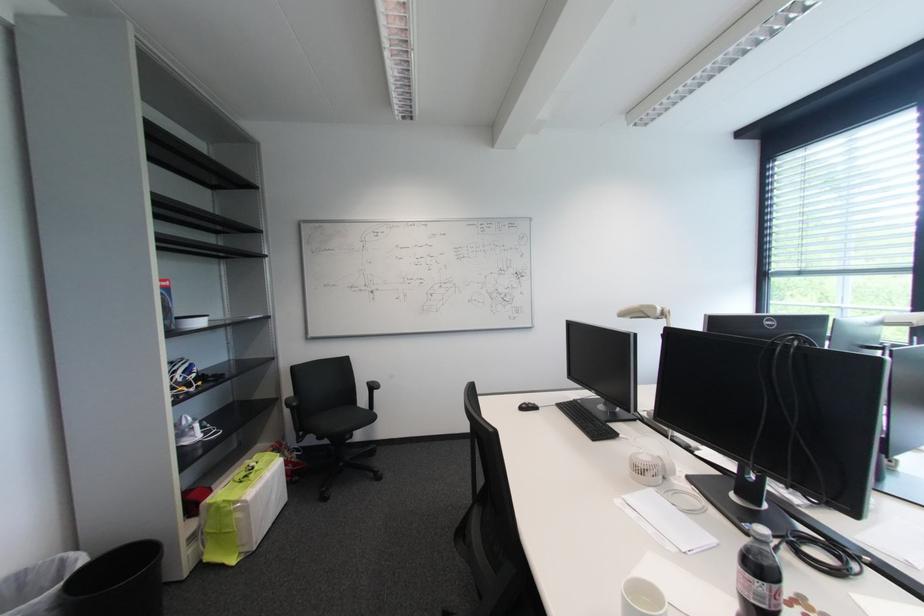
Where is `white round container`? white round container is located at coordinates (641, 598).